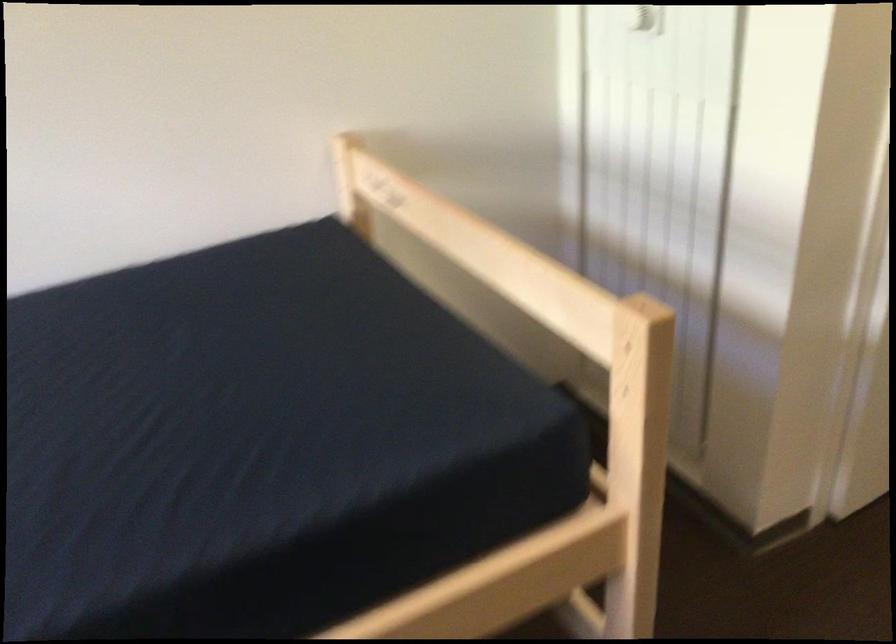
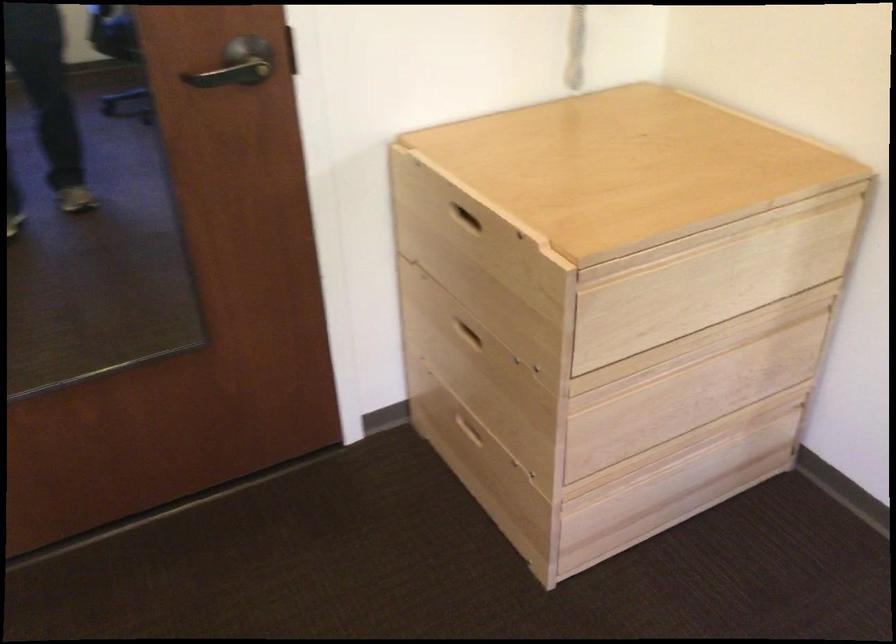
First-person continuous shooting, in which direction is the camera rotating?

The camera rotated toward right-down.